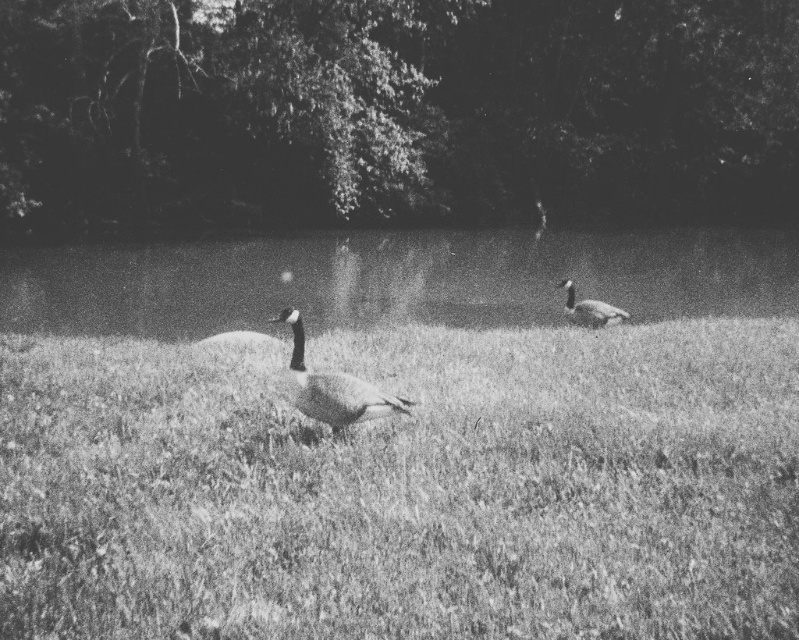
You are a photographer trying to capture a closeup of the dark gray feathered duck at center while standing on the grassy field at center. Can you fit the entire duck into your camera frame without moving your position?

The grassy field at center is wider than the dark gray feathered duck at center, so yes, you can fit the entire duck into your camera frame without moving your position.